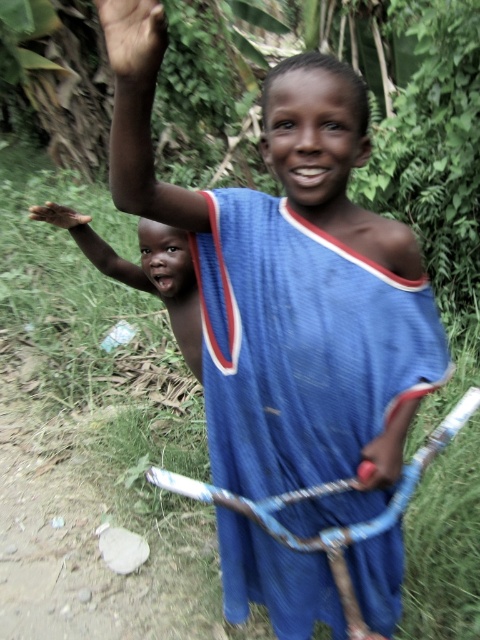
Who is more forward, (132, 3) or (376, 448)?

Point (132, 3)

Between point (109, 33) and point (370, 456), which one is positioned behind?

The point (370, 456) is behind.

Where is `brown skin at upper left`? The height and width of the screenshot is (640, 480). brown skin at upper left is located at coordinates (133, 36).

Is point (328, 579) less distant than point (56, 204)?

Yes.

Can you confirm if blue jersey at center is taller than smooth skin child at left?

Yes, blue jersey at center is taller than smooth skin child at left.

Between point (399, 552) and point (154, 259), which one is positioned behind?

Point (154, 259)

Where is `blue jersey at center`? This screenshot has width=480, height=640. blue jersey at center is located at coordinates (301, 346).

Is point (96, 241) farther from camera compared to point (392, 476)?

Yes, point (96, 241) is farther from viewer.

Is smooth skin child at left above smooth plastic handle at lower right?

Yes.

Between point (179, 259) and point (398, 440), which one is positioned behind?

The point (179, 259) is behind.

This screenshot has height=640, width=480. In order to click on smooth skin child at left in this screenshot , I will do `click(144, 269)`.